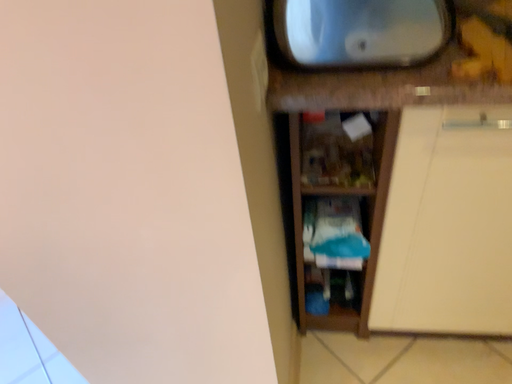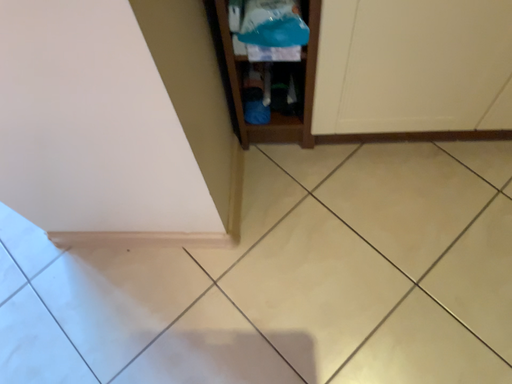
Question: Which way did the camera rotate in the video?

Choices:
 (A) rotated upward
 (B) rotated downward

Answer: (B)